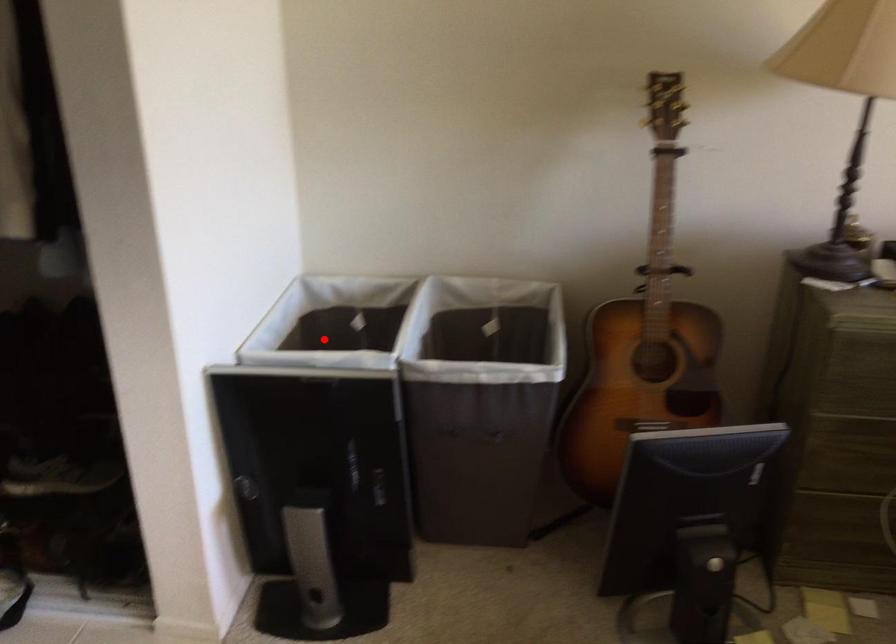
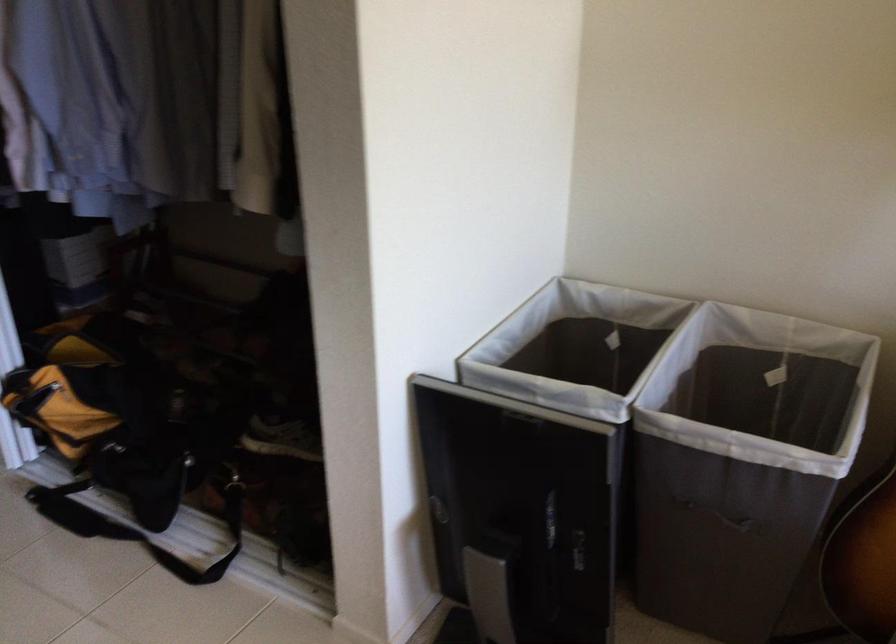
Where in the second image is the point corresponding to the highlighted location from the first image?

(574, 346)